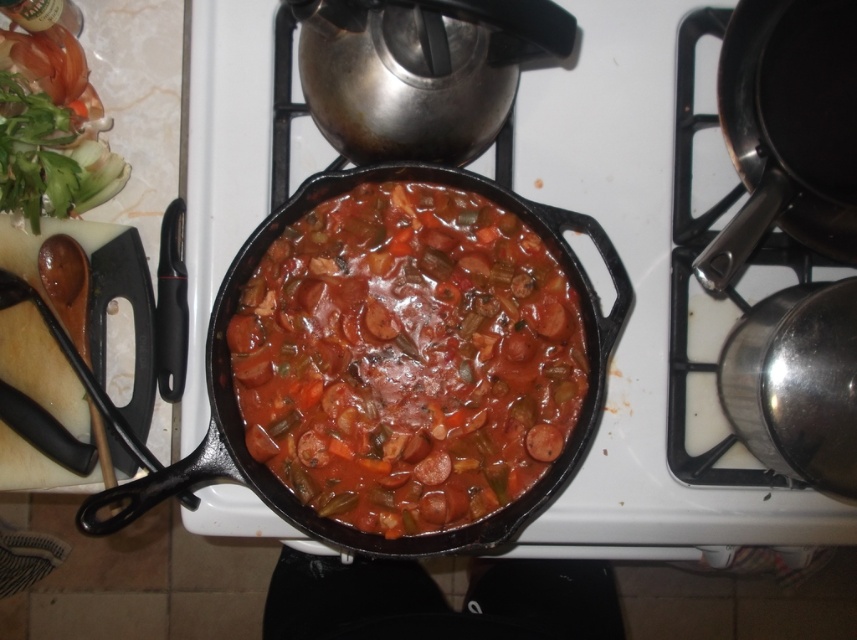
Question: Can you confirm if black cast iron skillet at center is positioned above green leafy vegetable at upper left?

Choices:
 (A) no
 (B) yes

Answer: (A)

Question: Is cast iron skillet at center thinner than black cast iron skillet at center?

Choices:
 (A) yes
 (B) no

Answer: (B)

Question: Observing the image, what is the correct spatial positioning of cast iron skillet at center in reference to black cast iron frying pan at upper right?

Choices:
 (A) right
 (B) left

Answer: (B)

Question: Which object is the farthest from the black cast iron skillet at center?

Choices:
 (A) black cast iron frying pan at upper right
 (B) green leafy vegetable at upper left
 (C) cast iron skillet at center

Answer: (B)

Question: Among these points, which one is nearest to the camera?

Choices:
 (A) (399, 176)
 (B) (790, 216)
 (C) (610, 141)
 (D) (22, 120)

Answer: (B)

Question: Which of these objects is positioned farthest from the black cast iron skillet at center?

Choices:
 (A) black cast iron frying pan at upper right
 (B) green leafy vegetable at upper left

Answer: (B)